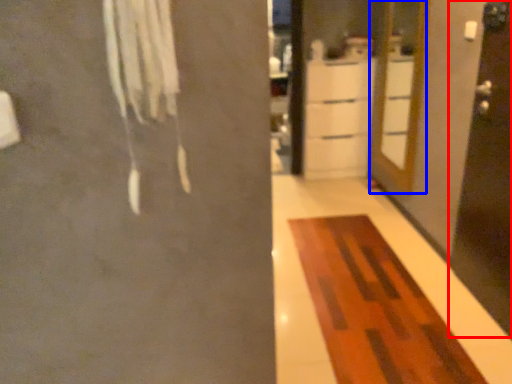
Question: Which of the following is the farthest to the observer, screen door (highlighted by a red box) or door (highlighted by a blue box)?

Choices:
 (A) screen door
 (B) door

Answer: (B)